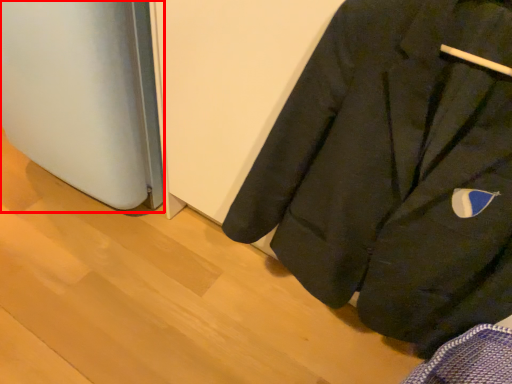
Question: From the image's perspective, considering the relative positions of appliance (annotated by the red box) and coat in the image provided, where is appliance (annotated by the red box) located with respect to the staircase?

Choices:
 (A) below
 (B) above

Answer: (B)